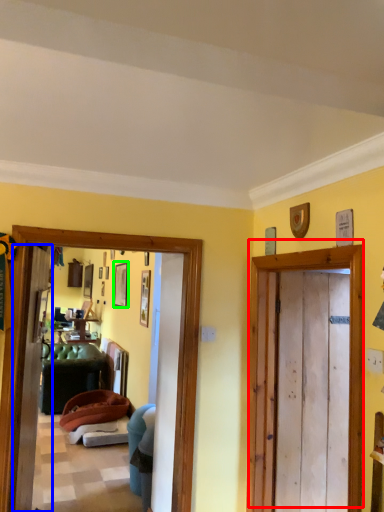
Question: Estimate the real-world distances between objects in this image. Which object is farther from door (highlighted by a red box), screen door (highlighted by a blue box) or picture frame (highlighted by a green box)?

Choices:
 (A) screen door
 (B) picture frame

Answer: (B)